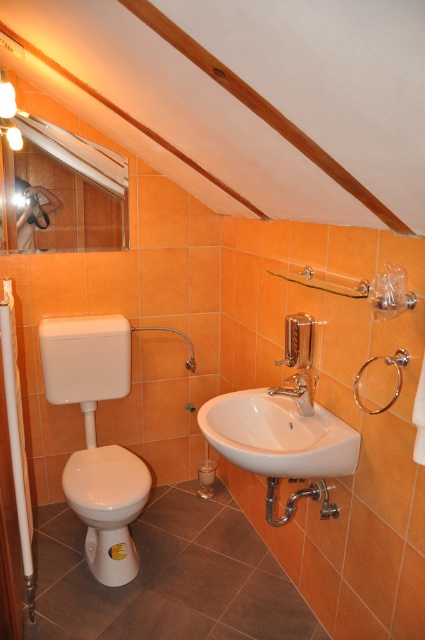
You are a contractor planning to install a new grab bar in the bathroom. The existing white plastic grab bar at left is located at point 0.688, 0.040. Can you confirm if this position is suitable for a standard grab bar installation?

The white plastic grab bar at left is positioned at point (17, 440), which is a suitable location for a standard grab bar installation as it aligns with typical mounting requirements.

You are a plumber trying to install a new pipe that needs to pass between the white glossy bidet at lower left and the wooden beam at upper center. Based on the bathroom layout, will the space between them allow the pipe to fit through?

The white glossy bidet at lower left is thinner than the wooden beam at upper center. Since the bidet is thinner, there should be enough space between them for the pipe to pass through.

You are a plumber checking the bathroom layout. You need to install a new pipe that connects the white glossy bidet at lower left to the wooden beam at upper center. Based on the bathroom layout, will the pipe need to be angled upwards or downwards from the bidet to reach the beam?

The white glossy bidet at lower left is located below the wooden beam at upper center, so the pipe will need to be angled upwards from the bidet to reach the beam.